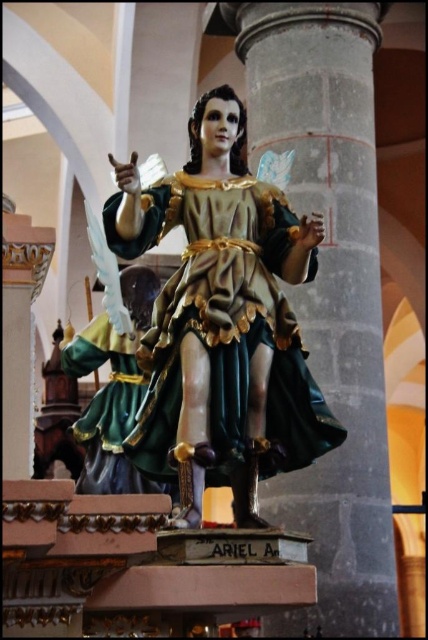
Does gray stone column at center appear over polychrome wood statue at center?

Yes.

Where is `gray stone column at center`? Image resolution: width=428 pixels, height=640 pixels. gray stone column at center is located at coordinates (329, 292).